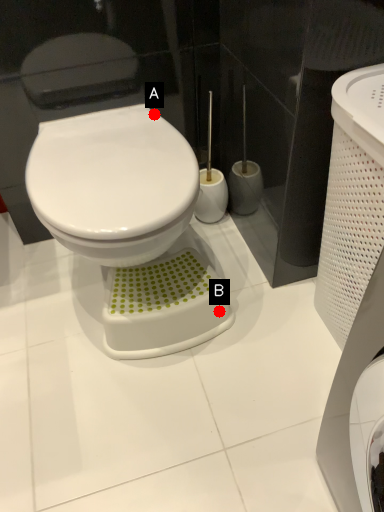
Question: Two points are circled on the image, labeled by A and B beside each circle. Which of the following is the farthest from the observer?

Choices:
 (A) A is further
 (B) B is further

Answer: (A)